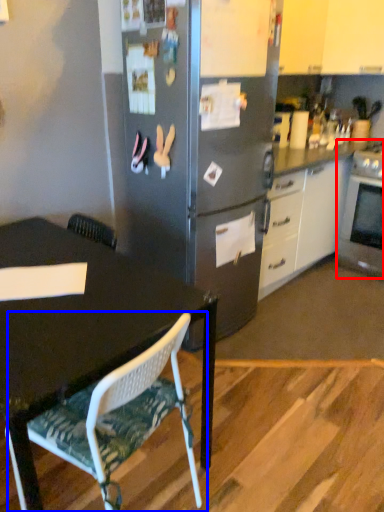
Question: Which point is closer to the camera, oven (highlighted by a red box) or chair (highlighted by a blue box)?

Choices:
 (A) oven
 (B) chair

Answer: (B)